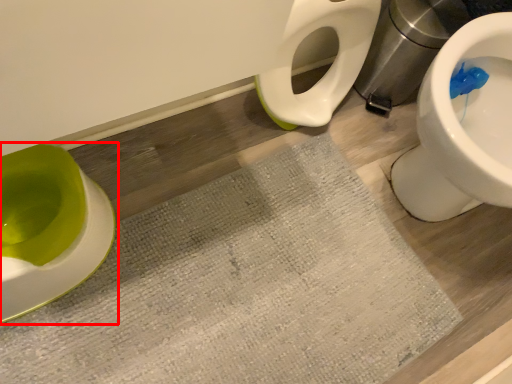
Question: Observing the image, what is the correct spatial positioning of toilet (annotated by the red box) in reference to bath mat?

Choices:
 (A) right
 (B) left

Answer: (B)